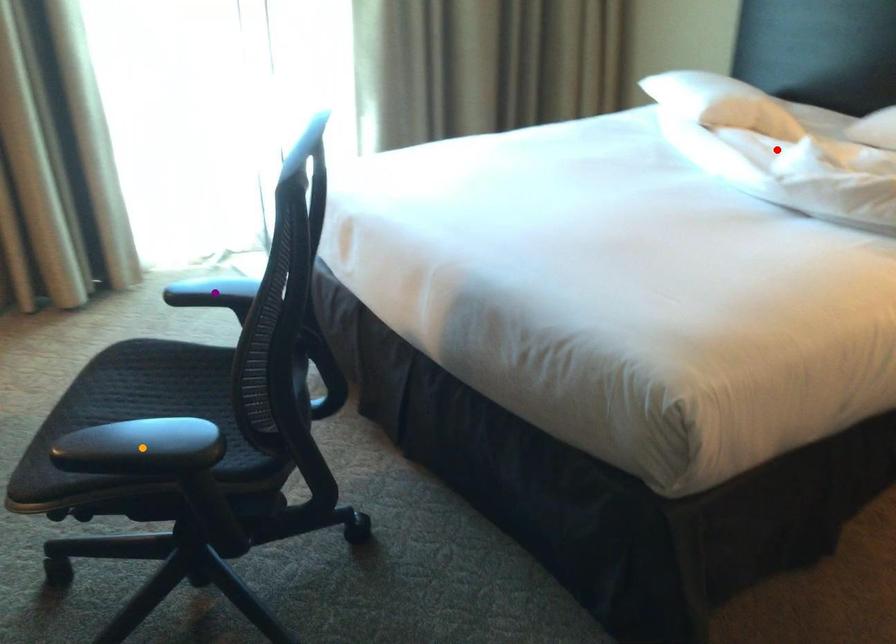
Order these from nearest to farthest:
orange point | red point | purple point

orange point, purple point, red point